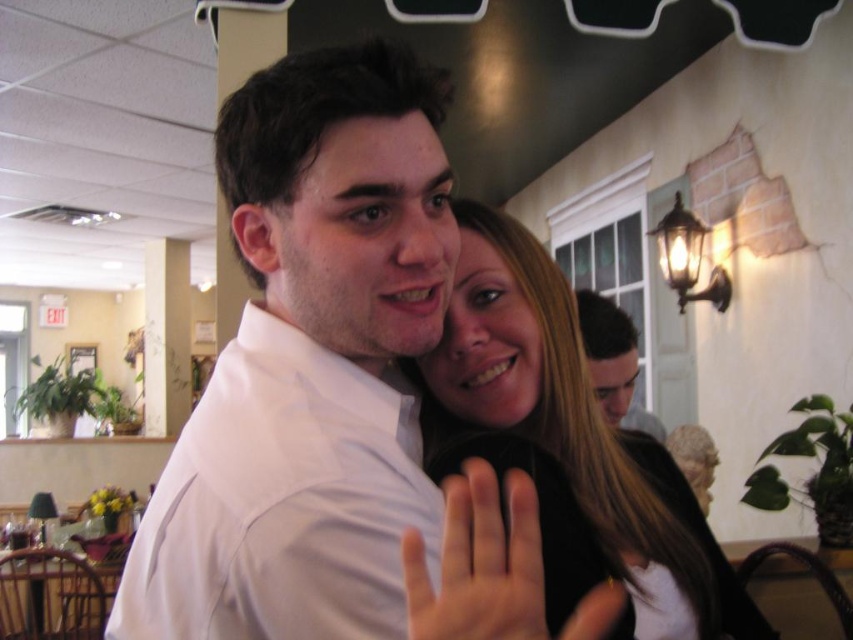
Question: Is white smooth shirt at center to the right of matte white shirt at upper center from the viewer's perspective?

Choices:
 (A) no
 (B) yes

Answer: (A)

Question: Based on their relative distances, which object is nearer to the smooth skin hand at center?

Choices:
 (A) matte white shirt at upper center
 (B) white smooth shirt at center

Answer: (B)

Question: Is white smooth shirt at center smaller than smooth black hair at center?

Choices:
 (A) no
 (B) yes

Answer: (A)

Question: Estimate the real-world distances between objects in this image. Which object is farther from the smooth black hair at center?

Choices:
 (A) white smooth shirt at center
 (B) smooth skin hand at center
 (C) matte white shirt at upper center

Answer: (C)

Question: Can you confirm if white smooth shirt at center is bigger than smooth black hair at center?

Choices:
 (A) yes
 (B) no

Answer: (A)

Question: Which of the following is the closest to the observer?

Choices:
 (A) (624, 394)
 (B) (457, 374)
 (C) (375, 106)
 (D) (520, 556)

Answer: (D)